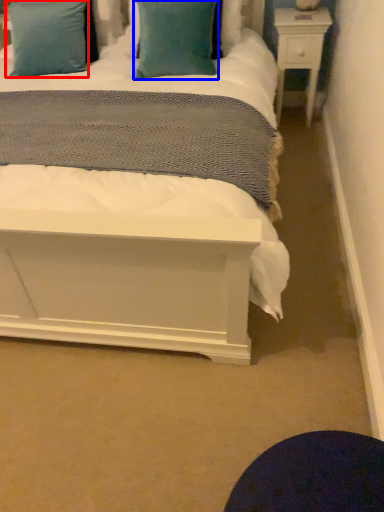
Question: Which object is further to the camera taking this photo, pillow (highlighted by a red box) or pillow (highlighted by a blue box)?

Choices:
 (A) pillow
 (B) pillow

Answer: (A)